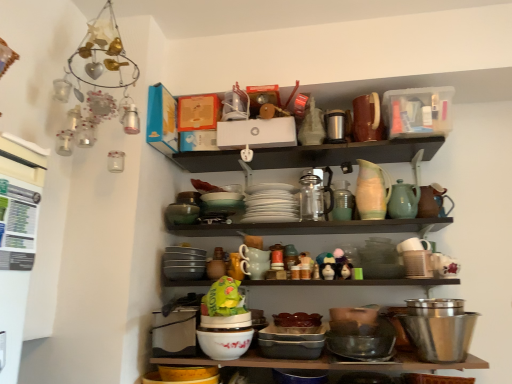
What do you see at coordinates (360, 345) in the screenshot?
I see `shiny metallic bowl at lower center, the second bowl when ordered from left to right` at bounding box center [360, 345].

What do you see at coordinates (440, 336) in the screenshot? The height and width of the screenshot is (384, 512). I see `stainless steel bowl at lower right, which is the 1th bowl from right to left` at bounding box center [440, 336].

I want to click on metallic thermos at upper center, arranged as the fourth tableware when viewed from the left, so click(x=337, y=126).

The height and width of the screenshot is (384, 512). Find the location of `shelf that is the 2nd object located above the green glass jar at center, which is counted as the third tableware, starting from the right (from the image's perspective)`. shelf that is the 2nd object located above the green glass jar at center, which is counted as the third tableware, starting from the right (from the image's perspective) is located at coordinates (419, 87).

Is green glass jar at center, the fifth tableware in the left-to-right sequence, next to matte plastic containers at upper center, arranged as the 2th shelf when ordered from the bottom?

green glass jar at center, the fifth tableware in the left-to-right sequence, and matte plastic containers at upper center, arranged as the 2th shelf when ordered from the bottom, are not in contact.

Based on their positions, is green glass jar at center, which is counted as the third tableware, starting from the right, located to the left or right of matte plastic containers at upper center, which is the first shelf from top to bottom?

Clearly, green glass jar at center, which is counted as the third tableware, starting from the right, is on the left of matte plastic containers at upper center, which is the first shelf from top to bottom, in the image.

Between point (343, 219) and point (302, 90), which one is positioned in front?

Positioned in front is point (343, 219).

Considering the relative sizes of matte ceramic dishes at center, the first shelf when ordered from bottom to top, and pastel ceramic pitcher at upper center, which appears as the second tableware when viewed from the right, in the image provided, is matte ceramic dishes at center, the first shelf when ordered from bottom to top, shorter than pastel ceramic pitcher at upper center, which appears as the second tableware when viewed from the right,?

Indeed, matte ceramic dishes at center, the first shelf when ordered from bottom to top, has a lesser height compared to pastel ceramic pitcher at upper center, which appears as the second tableware when viewed from the right.

In the scene shown: Between matte ceramic dishes at center, the first shelf when ordered from bottom to top, and pastel ceramic pitcher at upper center, which appears as the sixth tableware when viewed from the left, which one has smaller width?

pastel ceramic pitcher at upper center, which appears as the sixth tableware when viewed from the left, is thinner.

This screenshot has width=512, height=384. In the image, there is a matte plastic containers at upper center, arranged as the 2th shelf when ordered from the bottom. Identify the location of shelf below it (from the image's perspective). (345, 153).

Considering the sizes of matte plastic containers at upper center, which is the first shelf from top to bottom, and matte ceramic dishes at center, acting as the 2th shelf starting from the top, in the image, is matte plastic containers at upper center, which is the first shelf from top to bottom, taller or shorter than matte ceramic dishes at center, acting as the 2th shelf starting from the top,?

Considering their sizes, matte plastic containers at upper center, which is the first shelf from top to bottom, has less height than matte ceramic dishes at center, acting as the 2th shelf starting from the top.

Could you measure the distance between matte plastic containers at upper center, arranged as the 2th shelf when ordered from the bottom, and matte ceramic dishes at center, acting as the 2th shelf starting from the top?

The distance of matte plastic containers at upper center, arranged as the 2th shelf when ordered from the bottom, from matte ceramic dishes at center, acting as the 2th shelf starting from the top, is 8.93 centimeters.

Is matte plastic containers at upper center, arranged as the 2th shelf when ordered from the bottom, next to matte ceramic dishes at center, the first shelf when ordered from bottom to top, and touching it?

Absolutely, matte plastic containers at upper center, arranged as the 2th shelf when ordered from the bottom, is next to and touching matte ceramic dishes at center, the first shelf when ordered from bottom to top.

In terms of width, does speckled ceramic mug at center, acting as the seventh tableware starting from the right, look wider or thinner when compared to matte black bowl at center, which is counted as the first bowl, starting from the left?

Considering their sizes, speckled ceramic mug at center, acting as the seventh tableware starting from the right, looks slimmer than matte black bowl at center, which is counted as the first bowl, starting from the left.

Between speckled ceramic mug at center, acting as the seventh tableware starting from the right, and matte black bowl at center, the 3th bowl positioned from the right, which one has more height?

speckled ceramic mug at center, acting as the seventh tableware starting from the right, is taller.

From the image's perspective, would you say speckled ceramic mug at center, acting as the first tableware starting from the left, is shown under matte black bowl at center, which is counted as the first bowl, starting from the left?

No, from the image's perspective, speckled ceramic mug at center, acting as the first tableware starting from the left, is not below matte black bowl at center, which is counted as the first bowl, starting from the left.

Is point (256, 259) closer to camera compared to point (302, 353)?

No, it is not.

Would you say matte plastic containers at upper center, which is the first shelf from top to bottom, is inside or outside stainless steel bowl at lower right, which is the 3th bowl from left to right?

matte plastic containers at upper center, which is the first shelf from top to bottom, is spatially situated outside stainless steel bowl at lower right, which is the 3th bowl from left to right.

Consider the image. In terms of width, does matte plastic containers at upper center, which is the first shelf from top to bottom, look wider or thinner when compared to stainless steel bowl at lower right, which is the 3th bowl from left to right?

In the image, matte plastic containers at upper center, which is the first shelf from top to bottom, appears to be wider than stainless steel bowl at lower right, which is the 3th bowl from left to right.

How different are the orientations of matte plastic containers at upper center, arranged as the 2th shelf when ordered from the bottom, and stainless steel bowl at lower right, which is the 1th bowl from right to left, in degrees?

They differ by 0.855 degrees in their facing directions.

Between matte plastic containers at upper center, arranged as the 2th shelf when ordered from the bottom, and stainless steel bowl at lower right, which is the 3th bowl from left to right, which one has smaller size?

With smaller size is stainless steel bowl at lower right, which is the 3th bowl from left to right.

Where is `tableware that is the 2nd one when counting leftward from the stainless steel bowl at lower right, which is the 1th bowl from right to left`? Image resolution: width=512 pixels, height=384 pixels. tableware that is the 2nd one when counting leftward from the stainless steel bowl at lower right, which is the 1th bowl from right to left is located at coordinates (372, 191).

Which of these two, pastel ceramic pitcher at upper center, which appears as the sixth tableware when viewed from the left, or stainless steel bowl at lower right, which is the 1th bowl from right to left, is bigger?

With larger size is stainless steel bowl at lower right, which is the 1th bowl from right to left.

From a real-world perspective, is pastel ceramic pitcher at upper center, which appears as the sixth tableware when viewed from the left, physically above stainless steel bowl at lower right, which is the 3th bowl from left to right?

Indeed, from a real-world perspective, pastel ceramic pitcher at upper center, which appears as the sixth tableware when viewed from the left, stands above stainless steel bowl at lower right, which is the 3th bowl from left to right.

Which is more to the left, pastel ceramic pitcher at upper center, which appears as the second tableware when viewed from the right, or transparent glass carafe at center, arranged as the fifth tableware when viewed from the right?

transparent glass carafe at center, arranged as the fifth tableware when viewed from the right, is more to the left.

Considering the sizes of objects pastel ceramic pitcher at upper center, which appears as the sixth tableware when viewed from the left, and transparent glass carafe at center, positioned as the third tableware in left-to-right order, in the image provided, who is smaller, pastel ceramic pitcher at upper center, which appears as the sixth tableware when viewed from the left, or transparent glass carafe at center, positioned as the third tableware in left-to-right order,?

pastel ceramic pitcher at upper center, which appears as the sixth tableware when viewed from the left.

Who is shorter, pastel ceramic pitcher at upper center, which appears as the sixth tableware when viewed from the left, or transparent glass carafe at center, arranged as the fifth tableware when viewed from the right?

With less height is transparent glass carafe at center, arranged as the fifth tableware when viewed from the right.

Can you see pastel ceramic pitcher at upper center, which appears as the sixth tableware when viewed from the left, touching transparent glass carafe at center, arranged as the fifth tableware when viewed from the right?

No, pastel ceramic pitcher at upper center, which appears as the sixth tableware when viewed from the left, is not in contact with transparent glass carafe at center, arranged as the fifth tableware when viewed from the right.

This screenshot has height=384, width=512. Find the location of `the 4th tableware positioned below the matte plastic containers at upper center, which is the first shelf from top to bottom (from the image's perspective)`. the 4th tableware positioned below the matte plastic containers at upper center, which is the first shelf from top to bottom (from the image's perspective) is located at coordinates (342, 201).

This screenshot has width=512, height=384. What are the coordinates of `the 4th tableware to the right of the matte ceramic dishes at center, the first shelf when ordered from bottom to top, counting from the anchor's position` in the screenshot? It's located at (372, 191).

Estimate the real-world distances between objects in this image. Which object is closer to green glazed teapot at upper right, the 7th tableware when ordered from left to right, matte plastic containers at upper center, which is the first shelf from top to bottom, or speckled ceramic mug at center, acting as the first tableware starting from the left?

matte plastic containers at upper center, which is the first shelf from top to bottom, is positioned closer to the anchor green glazed teapot at upper right, the 7th tableware when ordered from left to right.

Considering their positions, is matte ceramic dishes at center, the first shelf when ordered from bottom to top, positioned further to matte plastic containers at upper center, which is the first shelf from top to bottom, than green glass jar at center, the fifth tableware in the left-to-right sequence?

Based on the image, green glass jar at center, the fifth tableware in the left-to-right sequence, appears to be further to matte plastic containers at upper center, which is the first shelf from top to bottom.

Estimate the real-world distances between objects in this image. Which object is closer to metallic thermos at upper center, acting as the 4th tableware starting from the right, matte black bowl at center, the 3th bowl positioned from the right, or matte ceramic dishes at center, acting as the 2th shelf starting from the top?

matte ceramic dishes at center, acting as the 2th shelf starting from the top, is positioned closer to the anchor metallic thermos at upper center, acting as the 4th tableware starting from the right.

Estimate the real-world distances between objects in this image. Which object is further from green plastic bag at center, green glazed teapot at upper right, the 7th tableware when ordered from left to right, or speckled ceramic mug at center, acting as the first tableware starting from the left?

green glazed teapot at upper right, the 7th tableware when ordered from left to right, is positioned further to the anchor green plastic bag at center.

Estimate the real-world distances between objects in this image. Which object is closer to speckled ceramic mug at center, acting as the first tableware starting from the left, white matte plates at center, which ranks as the sixth tableware in right-to-left order, or transparent glass carafe at center, arranged as the fifth tableware when viewed from the right?

Based on the image, white matte plates at center, which ranks as the sixth tableware in right-to-left order, appears to be nearer to speckled ceramic mug at center, acting as the first tableware starting from the left.

Considering their positions, is transparent glass carafe at center, positioned as the third tableware in left-to-right order, positioned further to stainless steel bowl at lower right, which is the 3th bowl from left to right, than green glass jar at center, which is counted as the third tableware, starting from the right?

transparent glass carafe at center, positioned as the third tableware in left-to-right order, is positioned further to the anchor stainless steel bowl at lower right, which is the 3th bowl from left to right.

Based on their spatial positions, is speckled ceramic mug at center, acting as the seventh tableware starting from the right, or matte plastic containers at upper center, which is the first shelf from top to bottom, further from shiny metallic bowl at lower center, the second bowl when ordered from left to right?

matte plastic containers at upper center, which is the first shelf from top to bottom.

Looking at the image, which one is located further to white matte plates at center, arranged as the 2th tableware when viewed from the left, transparent glass carafe at center, positioned as the third tableware in left-to-right order, or matte black bowl at center, which is counted as the first bowl, starting from the left?

The object further to white matte plates at center, arranged as the 2th tableware when viewed from the left, is matte black bowl at center, which is counted as the first bowl, starting from the left.

At what (x,y) coordinates should I click in order to perform the action: click on shelf between metallic thermos at upper center, arranged as the fourth tableware when viewed from the left, and shiny metallic bowl at lower center, which ranks as the second bowl in right-to-left order, in the up-down direction. Please return your answer as a coordinate pair (x, y). This screenshot has width=512, height=384. Looking at the image, I should click on (345, 153).

Where is `shelf between matte plastic containers at upper center, arranged as the 2th shelf when ordered from the bottom, and pastel ceramic pitcher at upper center, which appears as the sixth tableware when viewed from the left, vertically`? The image size is (512, 384). shelf between matte plastic containers at upper center, arranged as the 2th shelf when ordered from the bottom, and pastel ceramic pitcher at upper center, which appears as the sixth tableware when viewed from the left, vertically is located at coordinates (345, 153).

Where is `bowl between matte ceramic dishes at center, the first shelf when ordered from bottom to top, and matte black bowl at center, the 3th bowl positioned from the right, in the vertical direction`? The image size is (512, 384). bowl between matte ceramic dishes at center, the first shelf when ordered from bottom to top, and matte black bowl at center, the 3th bowl positioned from the right, in the vertical direction is located at coordinates (440, 336).

Find the location of a particular element. This screenshot has height=384, width=512. food that lies between matte plastic containers at upper center, arranged as the 2th shelf when ordered from the bottom, and shiny metallic bowl at lower center, the second bowl when ordered from left to right, from top to bottom is located at coordinates (223, 298).